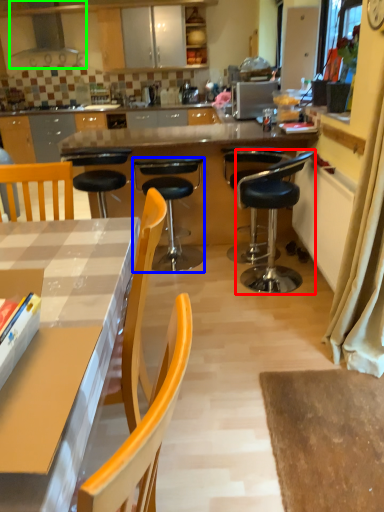
Question: Based on their relative distances, which object is nearer to chair (highlighted by a red box)? Choose from chair (highlighted by a blue box) and kitchen appliance (highlighted by a green box).

Choices:
 (A) chair
 (B) kitchen appliance

Answer: (A)